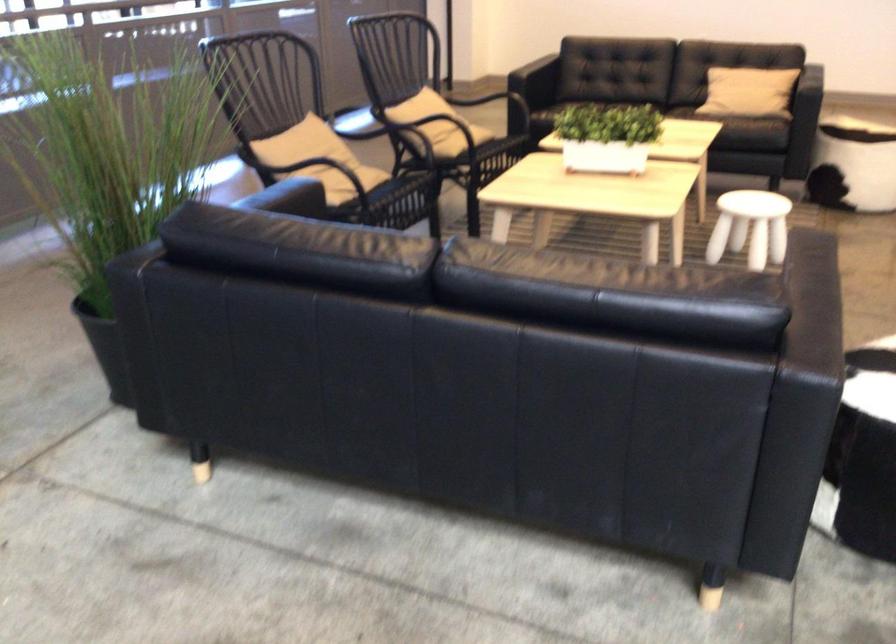
Identify the location of black sofa armrest. (812, 258).